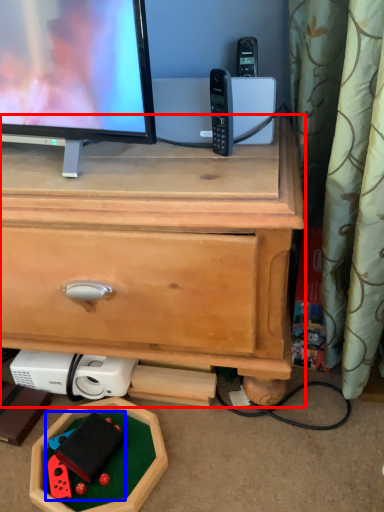
Question: Which object is closer to the camera taking this photo, chest of drawers (highlighted by a red box) or toy (highlighted by a blue box)?

Choices:
 (A) chest of drawers
 (B) toy

Answer: (A)